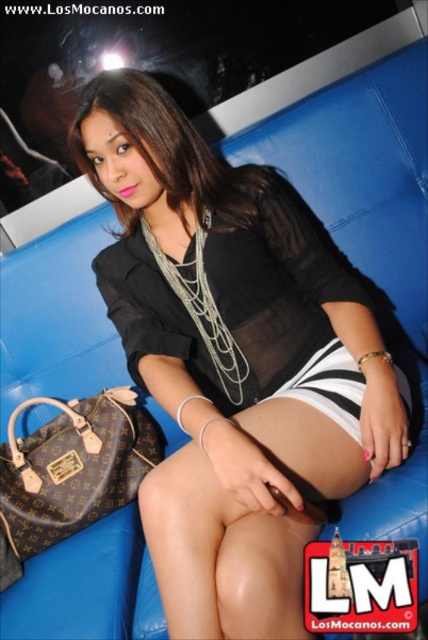
You are a fashion designer who wants to create a new line of clothing and accessories. You are analyzing the image to get inspiration. Which item in the image is larger in size between the black sheer blouse at center and the brown leather handbag at lower left?

The black sheer blouse at center is bigger than the brown leather handbag at lower left.

You are taking a photo of the scene and want to focus on both the point at [333,296] and the point at [53,426]. Which point should you adjust your focus to first to ensure both are in focus?

You should focus on point [333,296] first because it is closer to the camera, allowing the second point to fall within the depth of field.